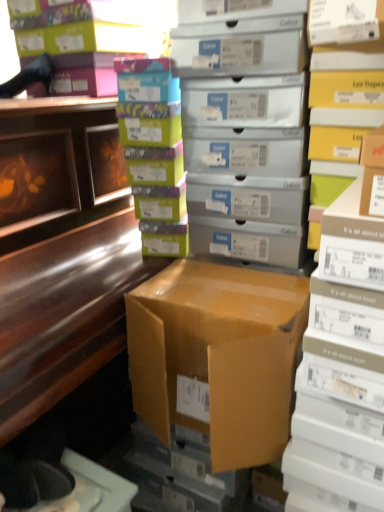
Question: Is yellow cardboard box at right, arranged as the first shelf when viewed from the right, situated inside brown cardboard box at center or outside?

Choices:
 (A) inside
 (B) outside

Answer: (B)

Question: In the image, is yellow cardboard box at right, the 2th shelf positioned from the left, on the left side or the right side of brown cardboard box at center?

Choices:
 (A) right
 (B) left

Answer: (A)

Question: Estimate the real-world distances between objects in this image. Which object is farther from the matte silver shoebox at center, which appears as the first shelf when viewed from the left?

Choices:
 (A) brown cardboard box at center
 (B) yellow cardboard box at right, the 2th shelf positioned from the left
 (C) multicolored cardboard boxes at center, positioned as the first book in left-to-right order
 (D) shiny brown desk at left
 (E) matte cardboard box at right, the 1th book from the right

Answer: (E)

Question: Considering the real-world distances, which object is farthest from the multicolored cardboard boxes at center, acting as the first book starting from the top?

Choices:
 (A) matte silver shoebox at center, positioned as the second shelf in right-to-left order
 (B) shiny brown desk at left
 (C) matte cardboard box at right, marked as the first book in a bottom-to-top arrangement
 (D) yellow cardboard box at right, the 2th shelf positioned from the left
 (E) brown cardboard box at center

Answer: (C)